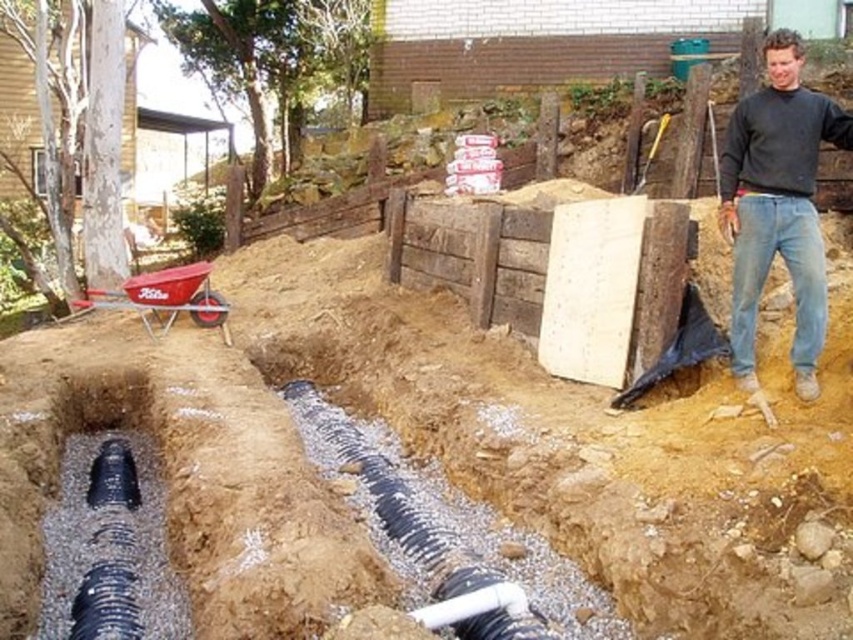
Does dark gray sweater at upper right have a greater height compared to black textured pipe at center?

Indeed, dark gray sweater at upper right has a greater height compared to black textured pipe at center.

Image resolution: width=853 pixels, height=640 pixels. Describe the element at coordinates (776, 205) in the screenshot. I see `dark gray sweater at upper right` at that location.

Locate an element on the screen. The image size is (853, 640). dark gray sweater at upper right is located at coordinates (776, 205).

Is point (97, 570) less distant than point (328, 435)?

Yes, it is in front of point (328, 435).

Image resolution: width=853 pixels, height=640 pixels. I want to click on black rubber pipe at lower left, so click(x=109, y=529).

Between black rubber pipe at lower left and dark gray sweater at upper right, which one appears on the left side from the viewer's perspective?

black rubber pipe at lower left is more to the left.

Who is more distant from viewer, (96, 608) or (799, 184)?

The point (799, 184) is more distant.

Find the location of a particular element. black rubber pipe at lower left is located at coordinates (109, 529).